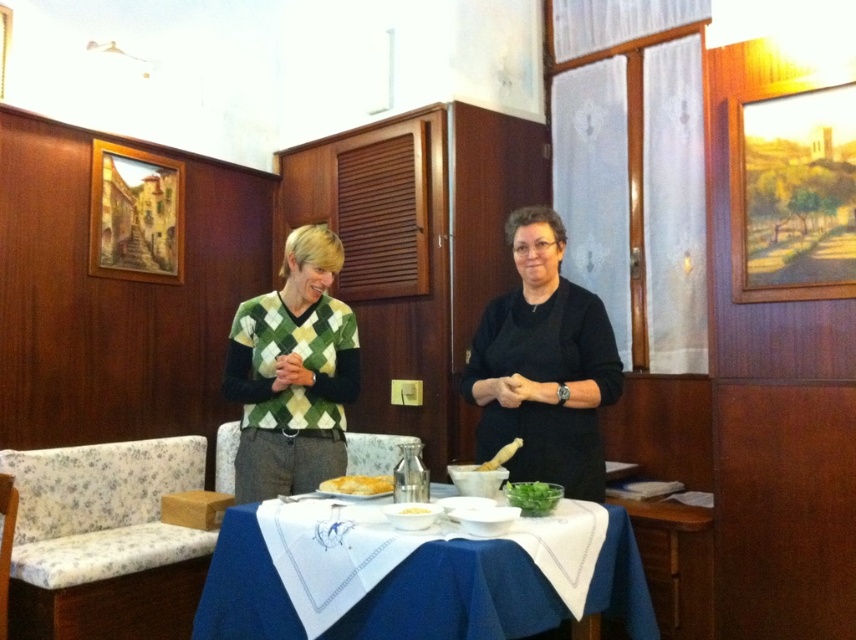
Question: Can you confirm if green leafy vegetable at center is wider than white matte mortar at center?

Choices:
 (A) yes
 (B) no

Answer: (A)

Question: Which object appears closest to the camera in this image?

Choices:
 (A) black matte dress at center
 (B) white matte bowl at center
 (C) green leafy vegetable at center

Answer: (B)

Question: Among these objects, which one is nearest to the camera?

Choices:
 (A) white matte mortar at center
 (B) green leafy vegetable at center
 (C) golden crispy bread at center
 (D) white matte bowl at center

Answer: (D)

Question: Does golden crispy bread at center have a larger size compared to white matte bowl at center?

Choices:
 (A) no
 (B) yes

Answer: (B)

Question: Does golden crispy bread at center appear over white matte mortar at center?

Choices:
 (A) yes
 (B) no

Answer: (B)

Question: Which object is the farthest from the white matte mortar at center?

Choices:
 (A) white matte bowl at center
 (B) green argyle sweater at center
 (C) black matte dress at center

Answer: (B)